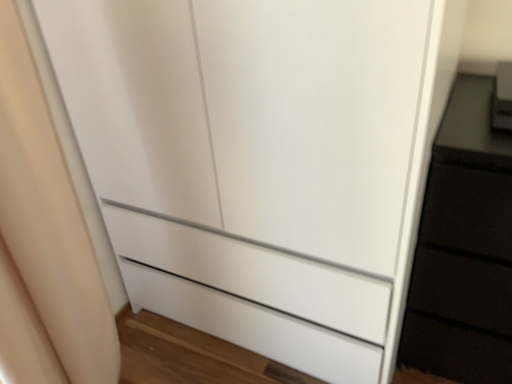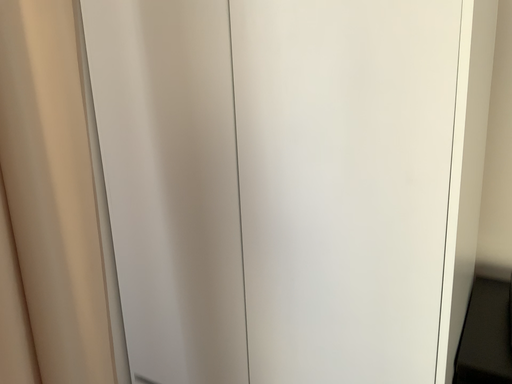
Question: Which way did the camera rotate in the video?

Choices:
 (A) rotated downward
 (B) rotated upward

Answer: (B)